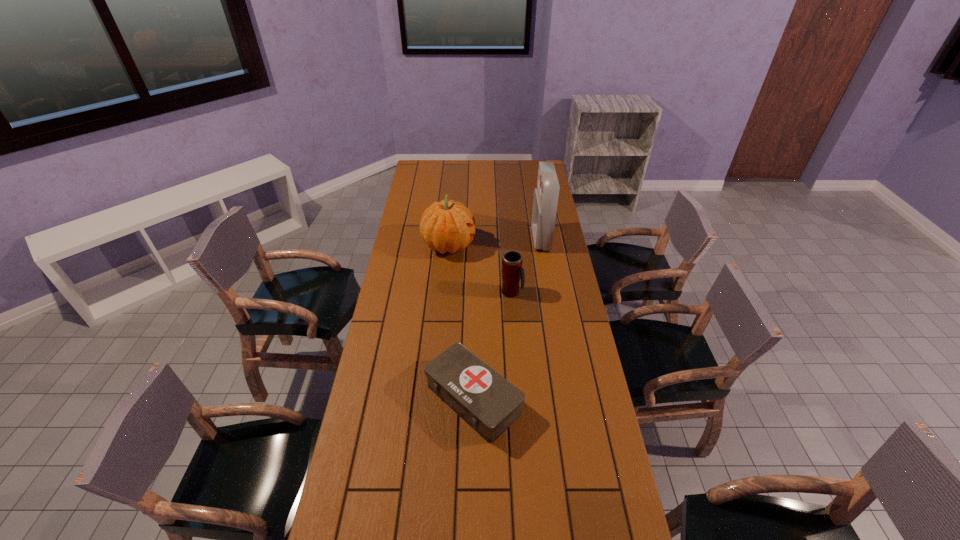
Locate an element on the screen. The height and width of the screenshot is (540, 960). vacant region that satisfies the following two spatial constraints: 1. on the carved face of the second tallest object; 2. on the left side of the left first-aid kit is located at coordinates (436, 399).

Locate an element on the screen. free location that satisfies the following two spatial constraints: 1. on the back side of the left first-aid kit; 2. on the carved face of the third shortest object is located at coordinates (475, 245).